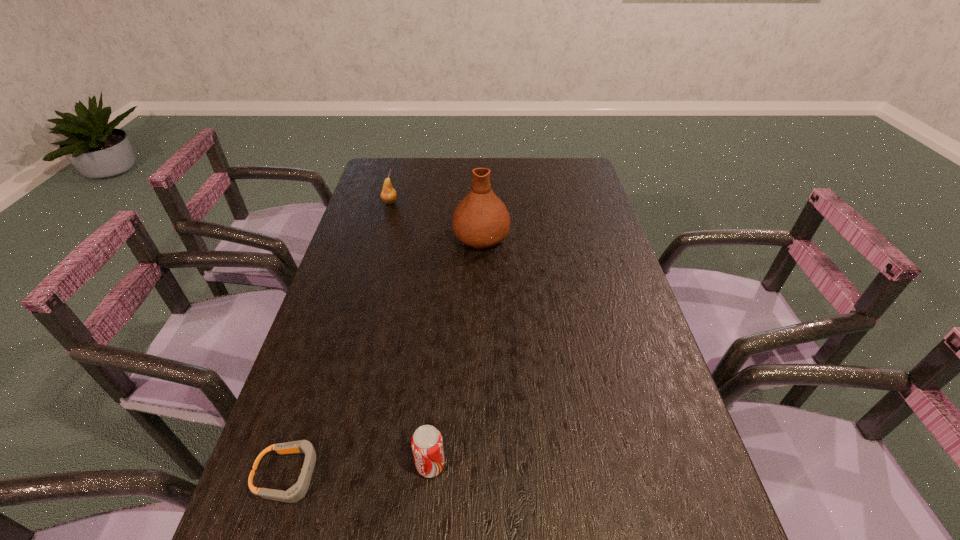
Find the location of a particular element. The image size is (960, 540). unoccupied position between the pitcher and the pear is located at coordinates (436, 220).

Identify the location of vacant area that lies between the soda can and the goggles. Image resolution: width=960 pixels, height=540 pixels. (360, 470).

Identify the location of unoccupied position between the tallest object and the farthest object. (436, 220).

At what (x,y) coordinates should I click in order to perform the action: click on vacant space that is in between the shortest object and the tallest object. Please return your answer as a coordinate pair (x, y). This screenshot has width=960, height=540. Looking at the image, I should click on (385, 356).

Where is `empty location between the goggles and the pear`? empty location between the goggles and the pear is located at coordinates (340, 339).

Locate an element on the screen. The width and height of the screenshot is (960, 540). unoccupied area between the pitcher and the shortest object is located at coordinates (385, 356).

Point out which object is positioned as the nearest to the soda can. Please provide its 2D coordinates. Your answer should be formatted as a tuple, i.e. [(x, y)], where the tuple contains the x and y coordinates of a point satisfying the conditions above.

[(295, 493)]

This screenshot has width=960, height=540. Find the location of `the third closest object to the soda can`. the third closest object to the soda can is located at coordinates (388, 195).